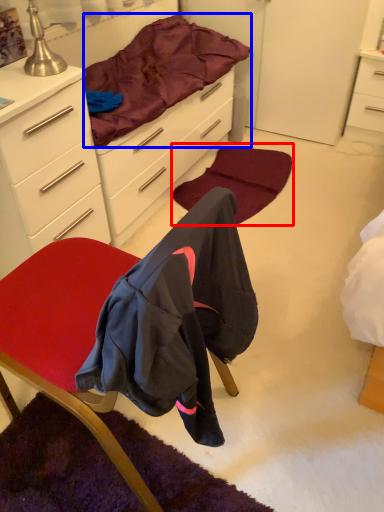
Question: Among these objects, which one is farthest to the camera, mat (highlighted by a red box) or bedding (highlighted by a blue box)?

Choices:
 (A) mat
 (B) bedding

Answer: (A)